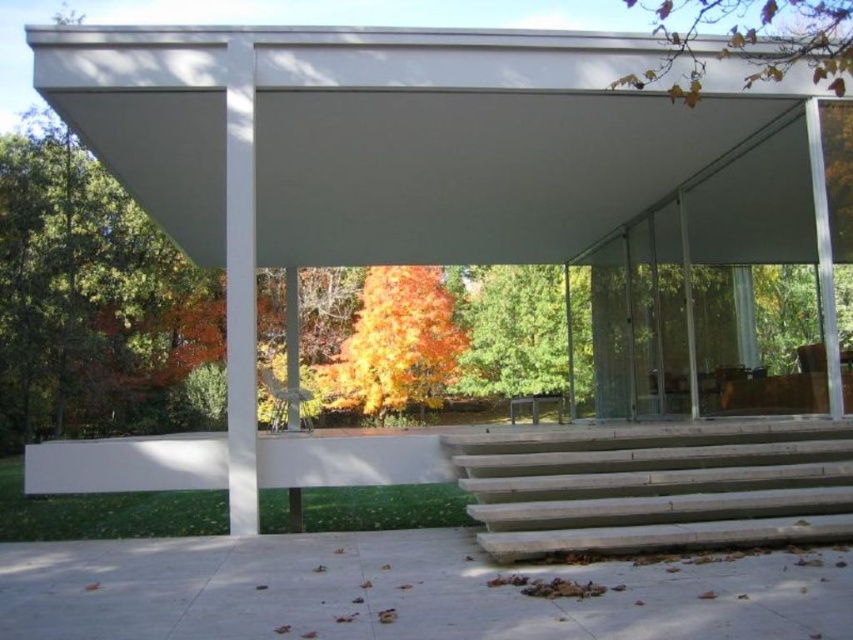
Does white matte canopy at upper center appear under green matte tree at center?

No, white matte canopy at upper center is not below green matte tree at center.

Who is more forward, (x=735, y=131) or (x=503, y=344)?

Point (x=735, y=131) is in front.

At what (x,y) coordinates should I click in order to perform the action: click on white matte canopy at upper center. Please return your answer as a coordinate pair (x, y). Looking at the image, I should click on (396, 134).

Who is positioned more to the left, white matte canopy at upper center or yellow leaves at upper right?

From the viewer's perspective, white matte canopy at upper center appears more on the left side.

Between white matte canopy at upper center and yellow leaves at upper right, which one has less height?

white matte canopy at upper center is shorter.

Locate an element on the screen. Image resolution: width=853 pixels, height=640 pixels. white matte canopy at upper center is located at coordinates (396, 134).

Between orange leafy tree at center and yellow leaves at upper right, which one is positioned higher?

yellow leaves at upper right

Does orange leafy tree at center have a greater height compared to yellow leaves at upper right?

In fact, orange leafy tree at center may be shorter than yellow leaves at upper right.

Is point (445, 314) in front of point (720, 10)?

Yes, point (445, 314) is closer to viewer.

At what (x,y) coordinates should I click in order to perform the action: click on orange leafy tree at center. Please return your answer as a coordinate pair (x, y). The height and width of the screenshot is (640, 853). Looking at the image, I should click on (396, 344).